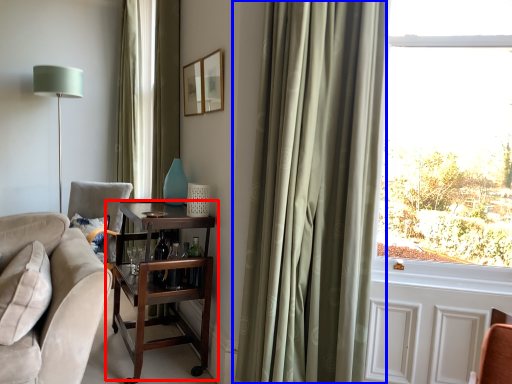
Question: Which point is closer to the camera, table (highlighted by a red box) or curtain (highlighted by a blue box)?

Choices:
 (A) table
 (B) curtain

Answer: (B)